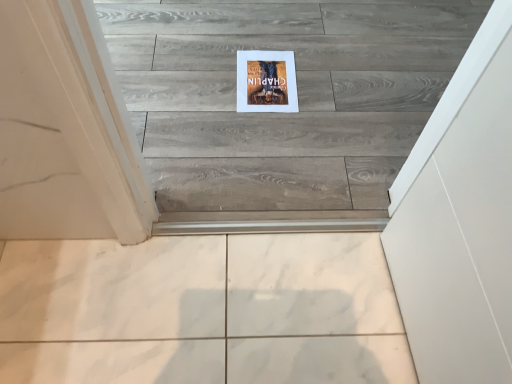
Question: From a real-world perspective, is matte cardboard poster at center physically located above or below white marble tile at lower center?

Choices:
 (A) above
 (B) below

Answer: (A)

Question: Based on their sizes in the image, would you say matte cardboard poster at center is bigger or smaller than white marble tile at lower center?

Choices:
 (A) small
 (B) big

Answer: (A)

Question: Considering the positions of matte cardboard poster at center and white marble tile at lower center in the image, is matte cardboard poster at center wider or thinner than white marble tile at lower center?

Choices:
 (A) wide
 (B) thin

Answer: (B)

Question: Considering their positions, is white marble tile at lower center located in front of or behind matte cardboard poster at center?

Choices:
 (A) behind
 (B) front

Answer: (B)

Question: Considering the positions of white marble tile at lower center and matte cardboard poster at center in the image, is white marble tile at lower center taller or shorter than matte cardboard poster at center?

Choices:
 (A) short
 (B) tall

Answer: (B)

Question: From the image's perspective, is white marble tile at lower center above or below matte cardboard poster at center?

Choices:
 (A) below
 (B) above

Answer: (A)

Question: Considering the positions of white marble tile at lower center and matte cardboard poster at center in the image, is white marble tile at lower center wider or thinner than matte cardboard poster at center?

Choices:
 (A) thin
 (B) wide

Answer: (B)